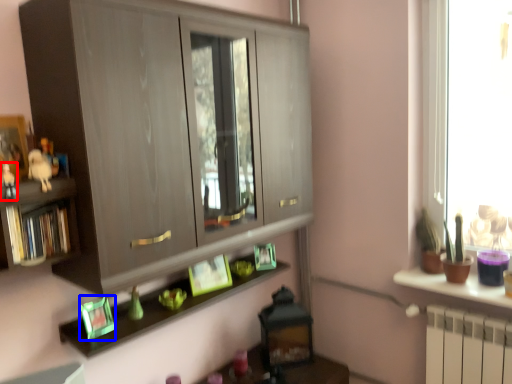
Question: Which object appears farthest to the camera in this image, toy (highlighted by a red box) or picture frame (highlighted by a blue box)?

Choices:
 (A) toy
 (B) picture frame

Answer: (B)